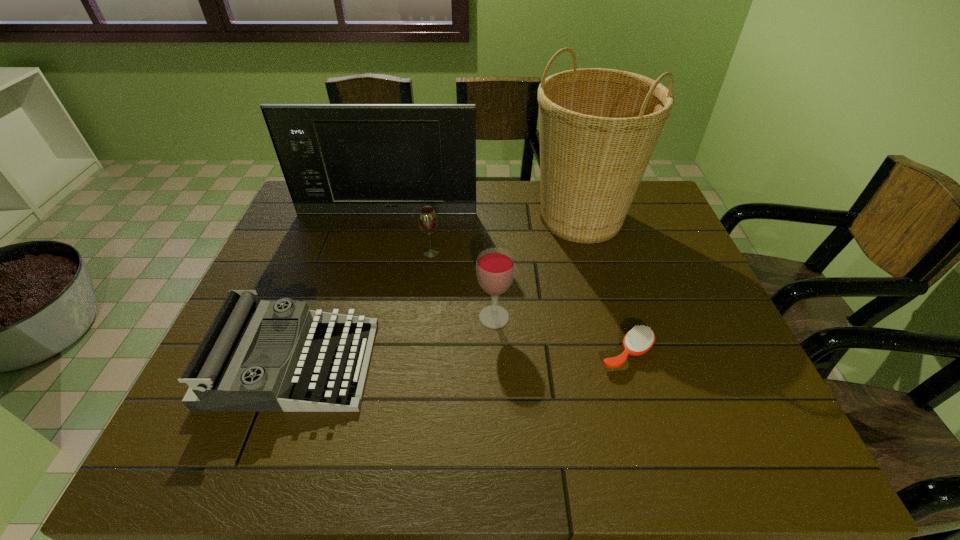
Where is `free space that satisfies the following two spatial constraints: 1. on the front panel of the fifth shortest object; 2. on the typing side of the typewriter`? This screenshot has width=960, height=540. free space that satisfies the following two spatial constraints: 1. on the front panel of the fifth shortest object; 2. on the typing side of the typewriter is located at coordinates (348, 363).